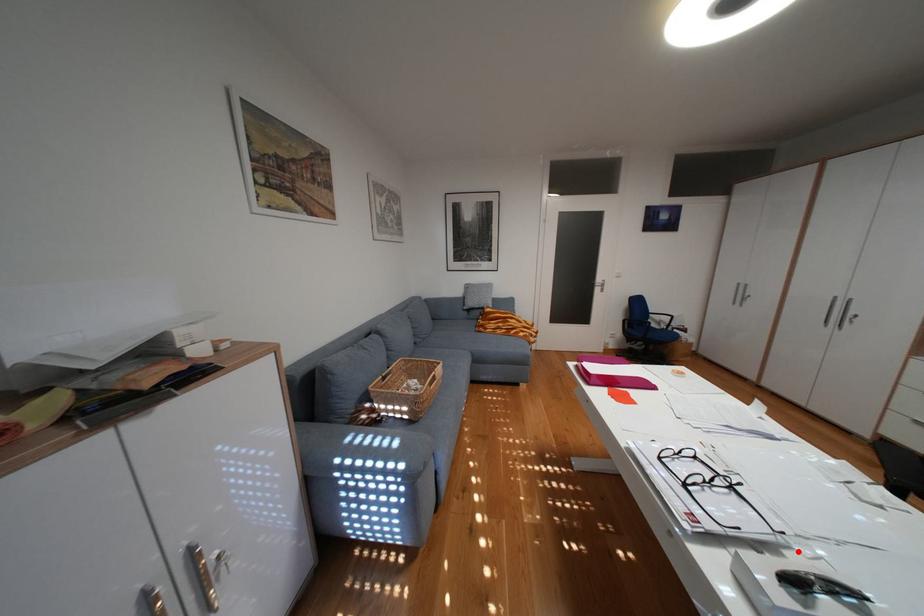
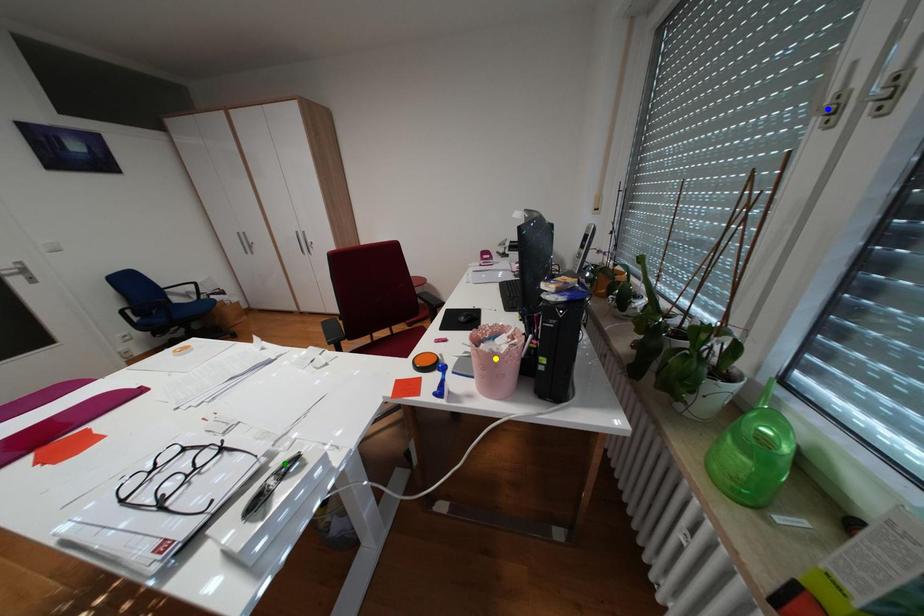
Question: I am providing you with two images of the same scene from different viewpoints. A red point is marked on the first image. You are given multiple points on the second image. Which point in image 2 represents the same 3d spot as the red point in image 1?

Choices:
 (A) blue point
 (B) yellow point
 (C) green point

Answer: (C)